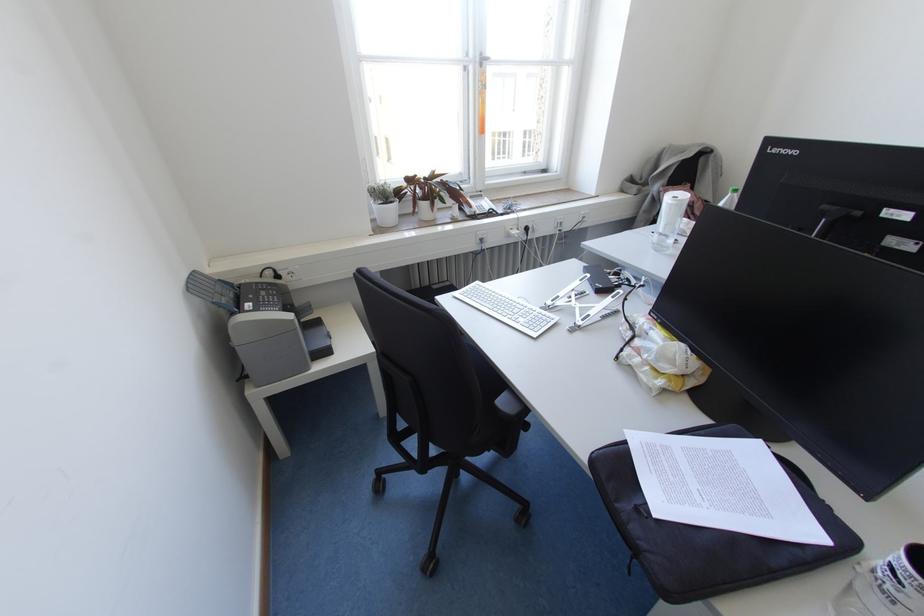
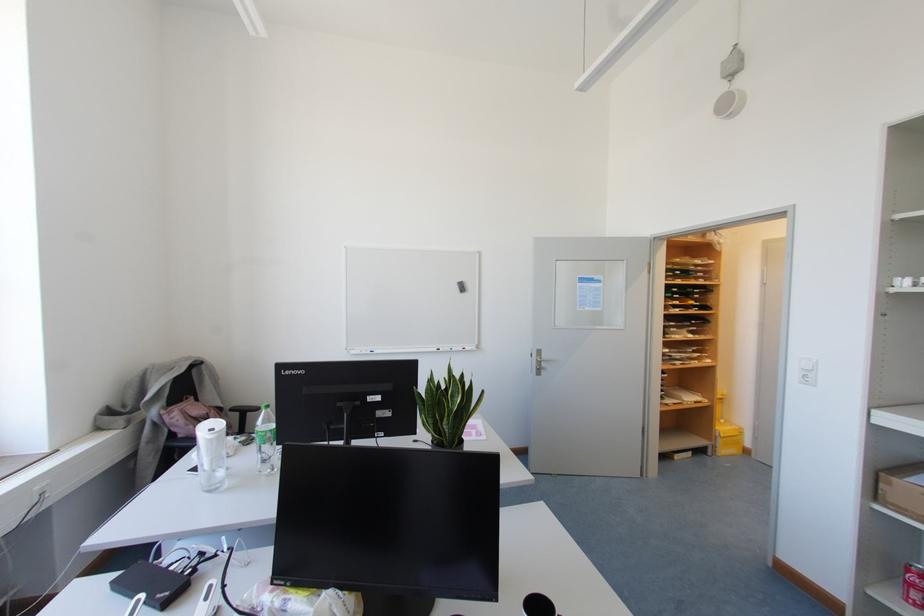
Question: How did the camera likely rotate?

Choices:
 (A) Left
 (B) Right
 (C) Up
 (D) Down

Answer: (B)